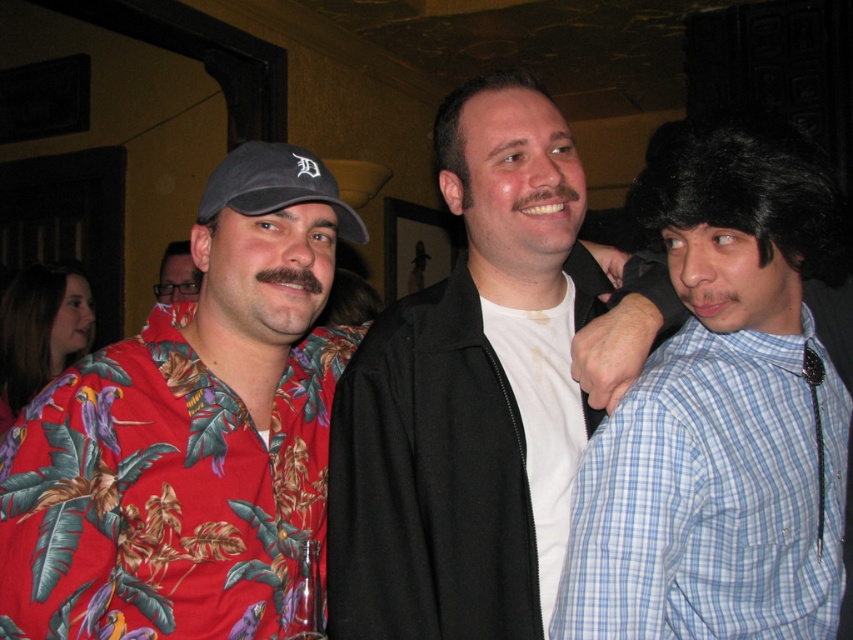
You are at a social event and want to know which item is taller between the white matte shirt at center and the black fabric baseball cap at left. Based on the scene description, can you determine this?

The white matte shirt at center is taller than the black fabric baseball cap at left according to the description.

You are standing in a dimly lit room where three people are gathered. You notice a point at coordinates (543, 420). What object is located at that point?

The white matte shirt at center is located at point (543, 420).

In the scene described, there is a point located at coordinates (189, 433). Based on the objects in the scene, what does this point most likely represent?

The point at (189, 433) most likely represents the location of the floral shirt at center, as indicated by the Objects Description.